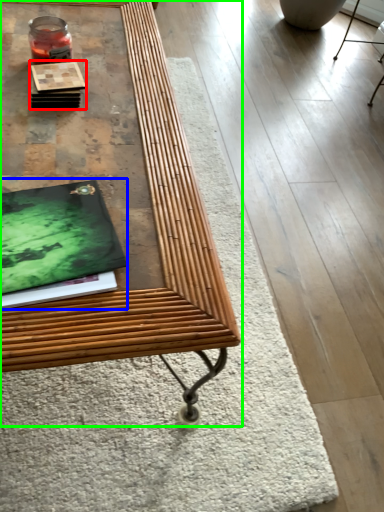
Question: Based on their relative distances, which object is nearer to book (highlighted by a red box)? Choose from magazine (highlighted by a blue box) and table (highlighted by a green box).

Choices:
 (A) magazine
 (B) table

Answer: (B)